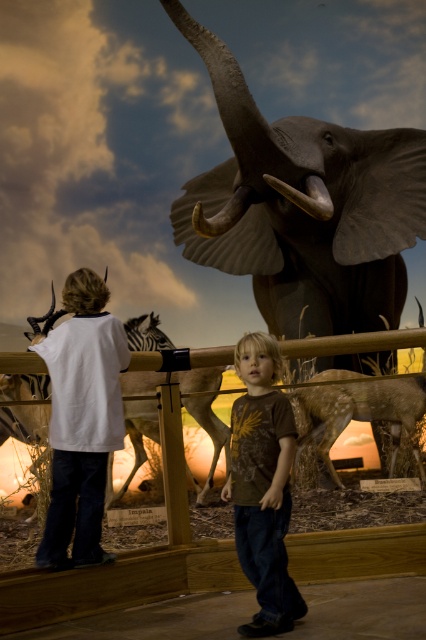
Question: Is gray matte elephant at upper center wider than matte ivory tusk at upper center?

Choices:
 (A) yes
 (B) no

Answer: (A)

Question: Does brown cotton shirt at center have a lesser width compared to matte ivory tusk at upper center?

Choices:
 (A) no
 (B) yes

Answer: (B)

Question: Which point is farther from the camera taking this photo?

Choices:
 (A) click(x=221, y=493)
 (B) click(x=299, y=275)
 (C) click(x=307, y=202)

Answer: (B)

Question: Which point appears farthest from the camera in this image?

Choices:
 (A) (325, 209)
 (B) (356, 230)
 (C) (249, 513)

Answer: (B)

Question: Is gray matte elephant at upper center wider than brown cotton shirt at center?

Choices:
 (A) no
 (B) yes

Answer: (B)

Question: Based on their relative distances, which object is nearer to the matte ivory tusk at upper center?

Choices:
 (A) brown cotton shirt at center
 (B) gray matte elephant at upper center

Answer: (B)